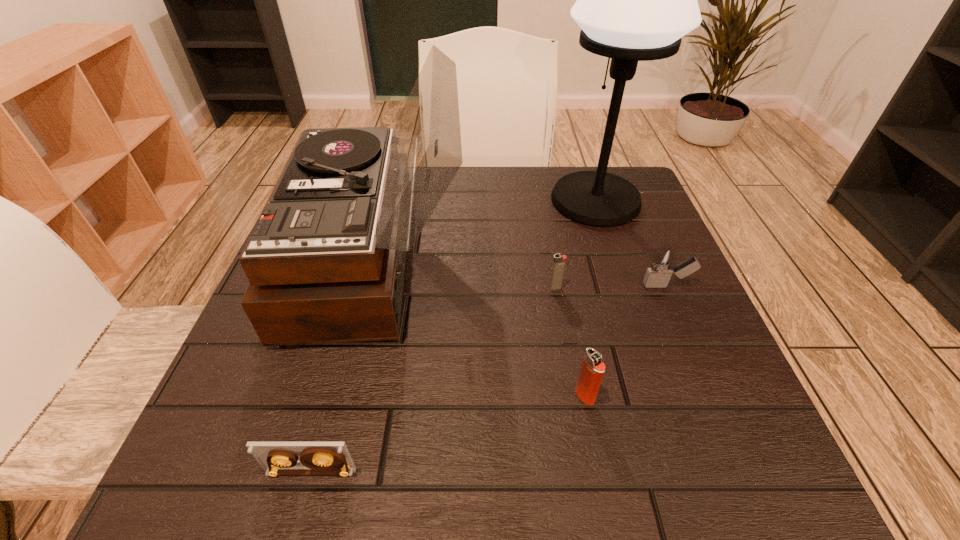
In the image, there is a desktop. Identify the location of free space at the near edge. (464, 444).

At what (x,y) coordinates should I click in order to perform the action: click on free region at the right edge. Please return your answer as a coordinate pair (x, y). The height and width of the screenshot is (540, 960). Looking at the image, I should click on (704, 330).

Where is `free spot between the nearest object and the rightmost igniter`? The image size is (960, 540). free spot between the nearest object and the rightmost igniter is located at coordinates (489, 379).

Identify the location of empty location between the nearest igniter and the second tallest object. The height and width of the screenshot is (540, 960). (481, 328).

Locate an element on the screen. free spot between the rightmost igniter and the videotape is located at coordinates (489, 379).

In order to click on free space that is in between the tallest object and the second nearest object in this screenshot , I will do `click(590, 298)`.

Find the location of a particular element. Image resolution: width=960 pixels, height=540 pixels. free spot between the second tallest object and the nearest object is located at coordinates (344, 366).

You are a GUI agent. You are given a task and a screenshot of the screen. Output one action in this format:
    pyautogui.click(x=<x>, y=<y>)
    Task: Click on the vacant region between the tallest object and the rightmost igniter
    This screenshot has width=960, height=540.
    Given the screenshot: What is the action you would take?
    pyautogui.click(x=631, y=243)

This screenshot has width=960, height=540. I want to click on free space between the rightmost igniter and the videotape, so click(489, 379).

The width and height of the screenshot is (960, 540). Identify the location of unoccupied position between the nearest igniter and the table lamp. (x=590, y=298).